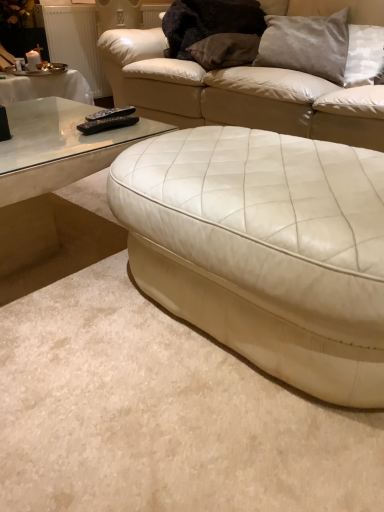
Question: Should I look upward or downward to see white leather studio couch at center, the 1th studio couch from the back?

Choices:
 (A) up
 (B) down

Answer: (A)

Question: Can you confirm if white leather studio couch at center, which is the second studio couch in front-to-back order, is taller than transparent glass coffee table at left?

Choices:
 (A) no
 (B) yes

Answer: (B)

Question: Is white leather studio couch at center, which is the second studio couch in front-to-back order, positioned before transparent glass coffee table at left?

Choices:
 (A) no
 (B) yes

Answer: (A)

Question: Is white leather studio couch at center, the 1th studio couch from the back, to the left of transparent glass coffee table at left from the viewer's perspective?

Choices:
 (A) yes
 (B) no

Answer: (B)

Question: Is transparent glass coffee table at left completely or partially inside white leather studio couch at center, which is the second studio couch in front-to-back order?

Choices:
 (A) no
 (B) yes

Answer: (A)

Question: Is white leather studio couch at center, the 1th studio couch from the back, shorter than transparent glass coffee table at left?

Choices:
 (A) no
 (B) yes

Answer: (A)

Question: Can you confirm if white leather studio couch at center, the 1th studio couch from the back, is positioned to the right of transparent glass coffee table at left?

Choices:
 (A) yes
 (B) no

Answer: (A)

Question: Could you tell me if white leather ottoman at center, which is the first studio couch in front-to-back order, is facing transparent glass coffee table at left?

Choices:
 (A) yes
 (B) no

Answer: (B)

Question: Is white leather ottoman at center, which is the first studio couch in front-to-back order, completely or partially outside of transparent glass coffee table at left?

Choices:
 (A) no
 (B) yes

Answer: (B)

Question: From the image's perspective, is white leather ottoman at center, which appears as the second studio couch when viewed from the back, beneath transparent glass coffee table at left?

Choices:
 (A) yes
 (B) no

Answer: (A)

Question: Is white leather ottoman at center, which is the first studio couch in front-to-back order, to the left of transparent glass coffee table at left from the viewer's perspective?

Choices:
 (A) no
 (B) yes

Answer: (A)

Question: Is white leather ottoman at center, which is the first studio couch in front-to-back order, taller than transparent glass coffee table at left?

Choices:
 (A) no
 (B) yes

Answer: (B)

Question: Does white leather ottoman at center, which is the first studio couch in front-to-back order, appear on the right side of transparent glass coffee table at left?

Choices:
 (A) yes
 (B) no

Answer: (A)

Question: Is satin gray pillow at upper right, positioned as the 2th pillow in left-to-right order, looking in the opposite direction of black plastic remote at left, which appears as the 1th remote when viewed from the back?

Choices:
 (A) yes
 (B) no

Answer: (B)